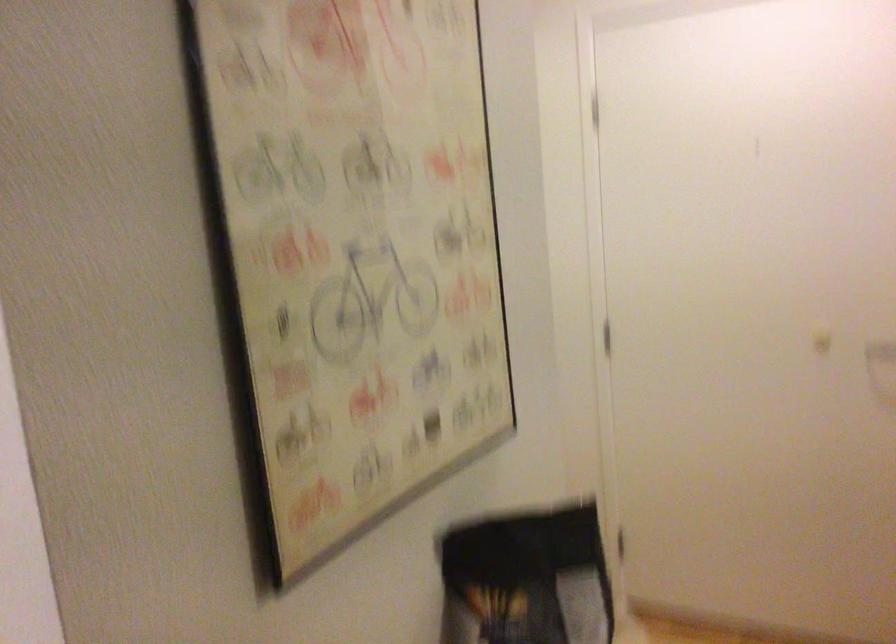
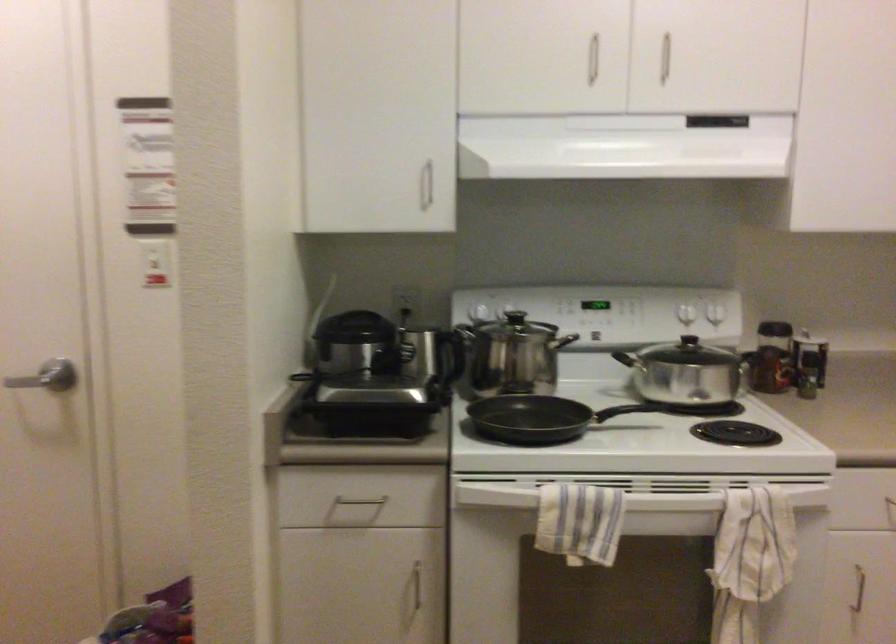
Question: How did the camera likely rotate?

Choices:
 (A) Left
 (B) Right
 (C) Up
 (D) Down

Answer: (B)